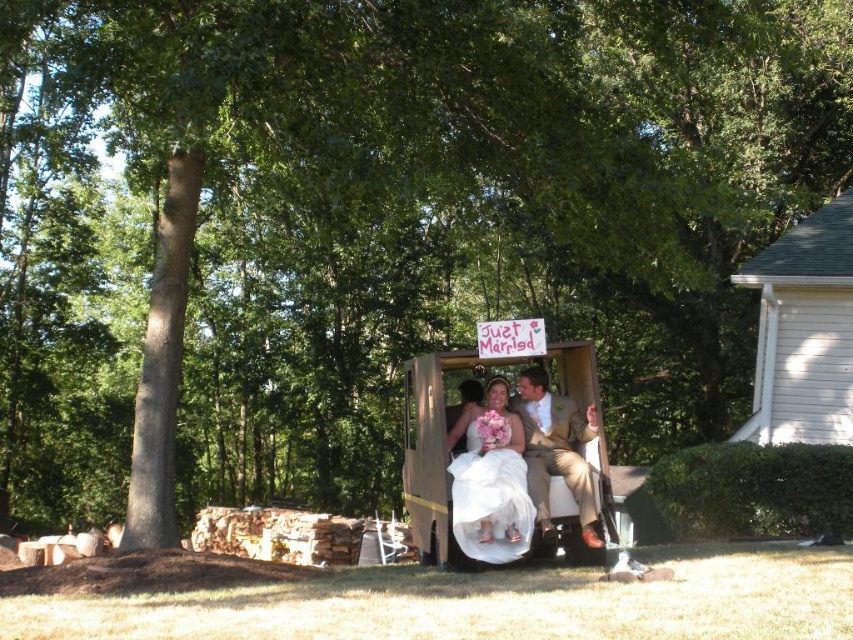
Question: In this image, where is white satin dress at center located relative to light brown textured suit at center?

Choices:
 (A) above
 (B) below

Answer: (B)

Question: Among these objects, which one is nearest to the camera?

Choices:
 (A) white satin dress at center
 (B) light brown textured suit at center

Answer: (A)

Question: Which object is closer to the camera taking this photo?

Choices:
 (A) light brown textured suit at center
 (B) white satin dress at center

Answer: (B)

Question: Is white satin dress at center wider than light brown textured suit at center?

Choices:
 (A) yes
 (B) no

Answer: (B)

Question: Does white satin dress at center have a smaller size compared to light brown textured suit at center?

Choices:
 (A) yes
 (B) no

Answer: (B)

Question: Which point is closer to the camera?

Choices:
 (A) (511, 461)
 (B) (532, 408)

Answer: (A)